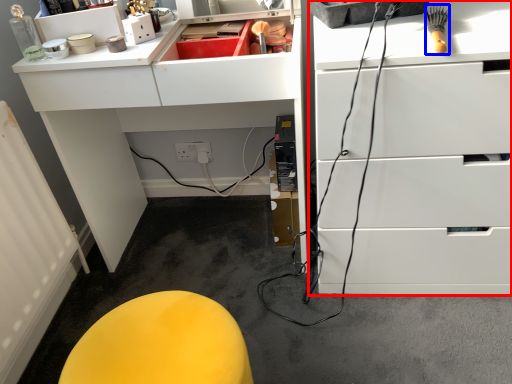
Question: Which of the following is the closest to the observer, chest of drawers (highlighted by a red box) or brush (highlighted by a blue box)?

Choices:
 (A) chest of drawers
 (B) brush

Answer: (A)